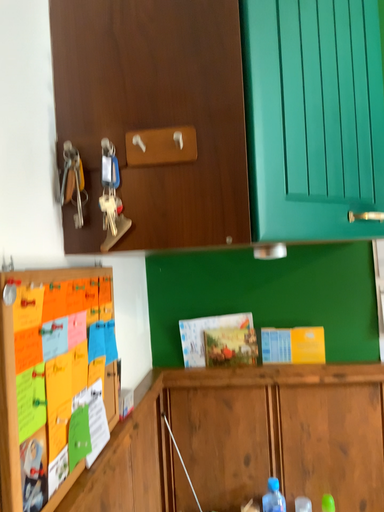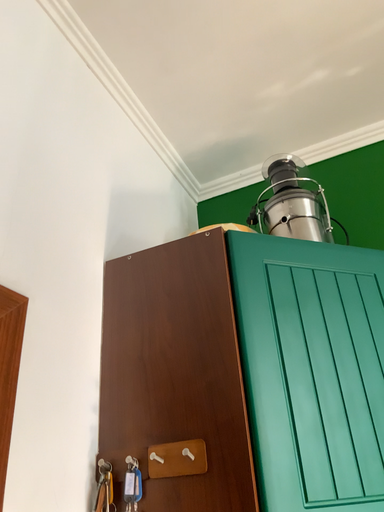
Question: Which way did the camera rotate in the video?

Choices:
 (A) rotated left
 (B) rotated right

Answer: (A)